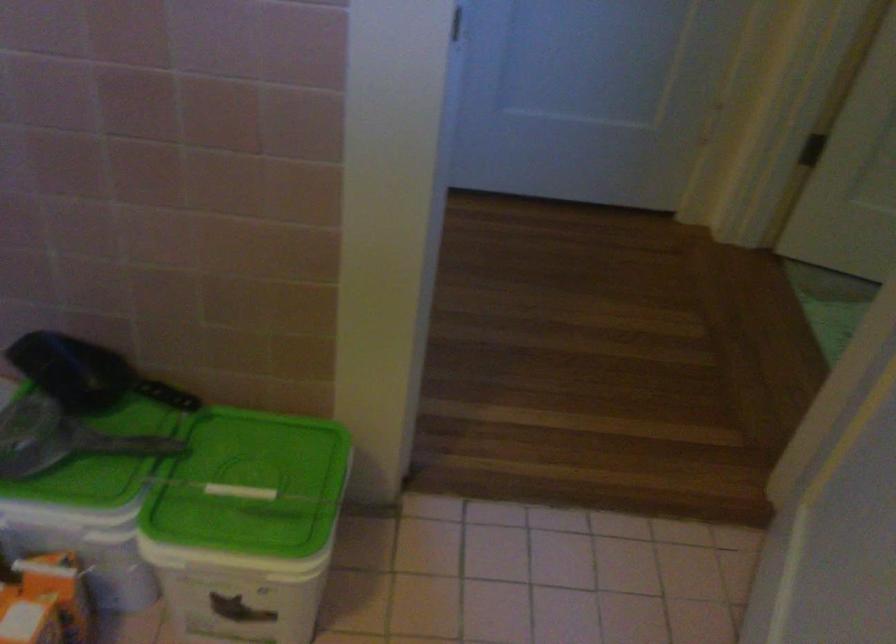
Describe the element at coordinates (85, 374) in the screenshot. The width and height of the screenshot is (896, 644). I see `a black scoop handle` at that location.